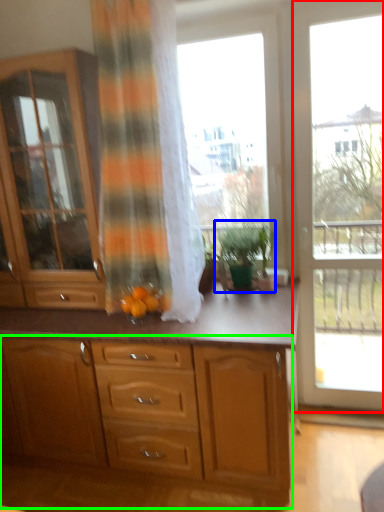
Question: Based on their relative distances, which object is farther from window (highlighted by a red box)? Choose from houseplant (highlighted by a blue box) and cabinetry (highlighted by a green box).

Choices:
 (A) houseplant
 (B) cabinetry

Answer: (B)